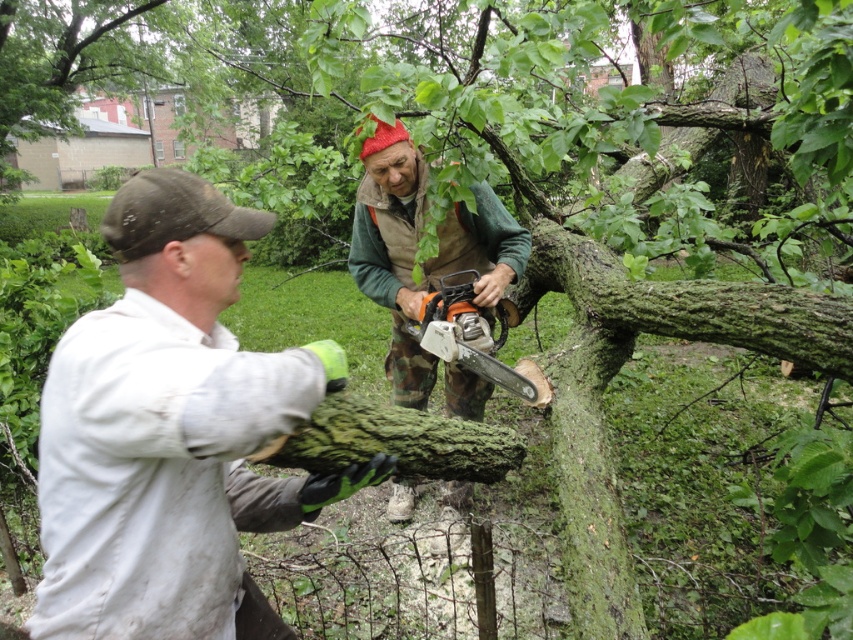
You are a safety inspector checking the equipment setup in the image. The camouflage pants at center and orange plastic chainsaw at center are both at the center. Is the chainsaw properly positioned for safe operation?

The camouflage pants at center is positioned over orange plastic chainsaw at center, which means the chainsaw is likely obstructed and not properly positioned for safe operation.

You are a safety inspector reviewing the image of two workers performing tree maintenance. Based on the scene, which object is positioned lower in the image between the white matte shirt at left and the orange plastic chainsaw at center?

The white matte shirt at left is located below the orange plastic chainsaw at center, so it is positioned lower in the image.